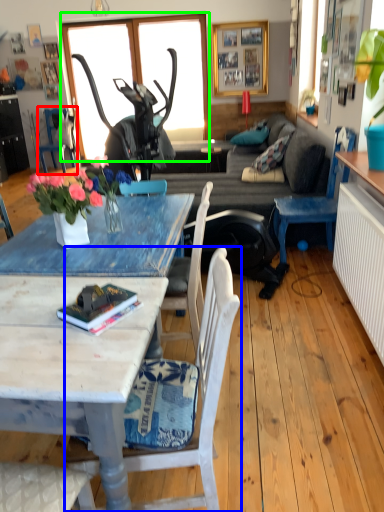
Question: Which object is positioned farthest from chair (highlighted by a red box)? Select from chair (highlighted by a blue box) and window (highlighted by a green box).

Choices:
 (A) chair
 (B) window

Answer: (A)